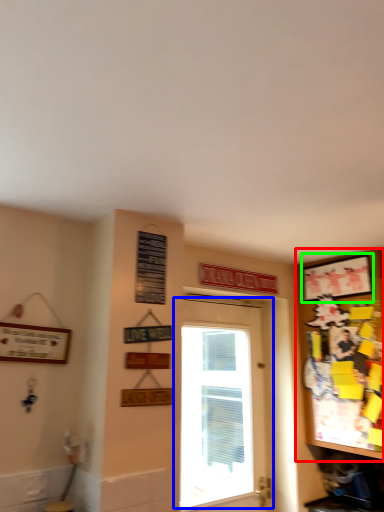
Question: Which is nearer to the cabinetry (highlighted by a red box)? door (highlighted by a blue box) or picture frame (highlighted by a green box).

Choices:
 (A) door
 (B) picture frame

Answer: (B)